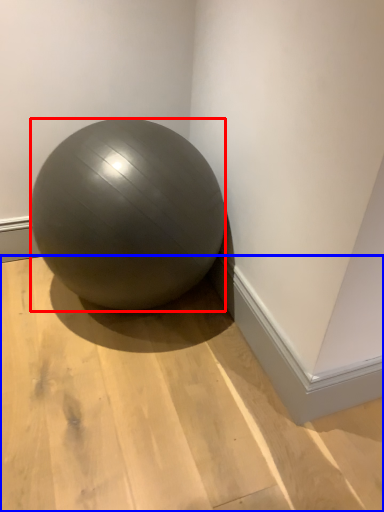
Question: Which point is closer to the camera, ball (highlighted by a red box) or surface (highlighted by a blue box)?

Choices:
 (A) ball
 (B) surface

Answer: (B)